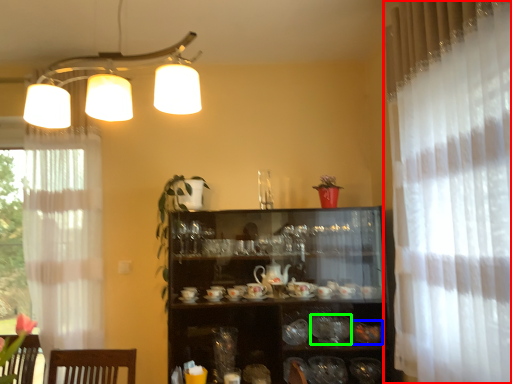
Question: Estimate the real-world distances between objects in this image. Which object is farther from curtain (highlighted by a red box), tableware (highlighted by a blue box) or tableware (highlighted by a green box)?

Choices:
 (A) tableware
 (B) tableware

Answer: (B)